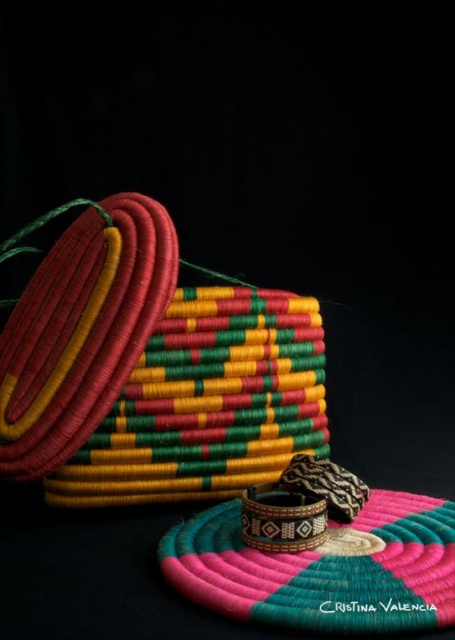
Question: Is bright multicolored woven basket at center behind brown woven bracelet at center?

Choices:
 (A) no
 (B) yes

Answer: (B)

Question: Among these points, which one is farthest from the camera?

Choices:
 (A) (62, 440)
 (B) (364, 493)
 (C) (369, 516)
 (D) (313, 504)

Answer: (B)

Question: Considering the real-world distances, which object is closest to the brown woven bracelet at center?

Choices:
 (A) leather-like brown bracelet at center
 (B) textured woven mat at center

Answer: (A)

Question: Which of the following is the closest to the observer?

Choices:
 (A) bright multicolored woven basket at center
 (B) leather-like brown bracelet at center
 (C) textured woven mat at center
 (D) textured woven bracelet at left

Answer: (C)

Question: Is bright multicolored woven basket at center behind textured woven mat at center?

Choices:
 (A) yes
 (B) no

Answer: (A)

Question: Does bright multicolored woven basket at center appear over textured woven bracelet at left?

Choices:
 (A) yes
 (B) no

Answer: (B)